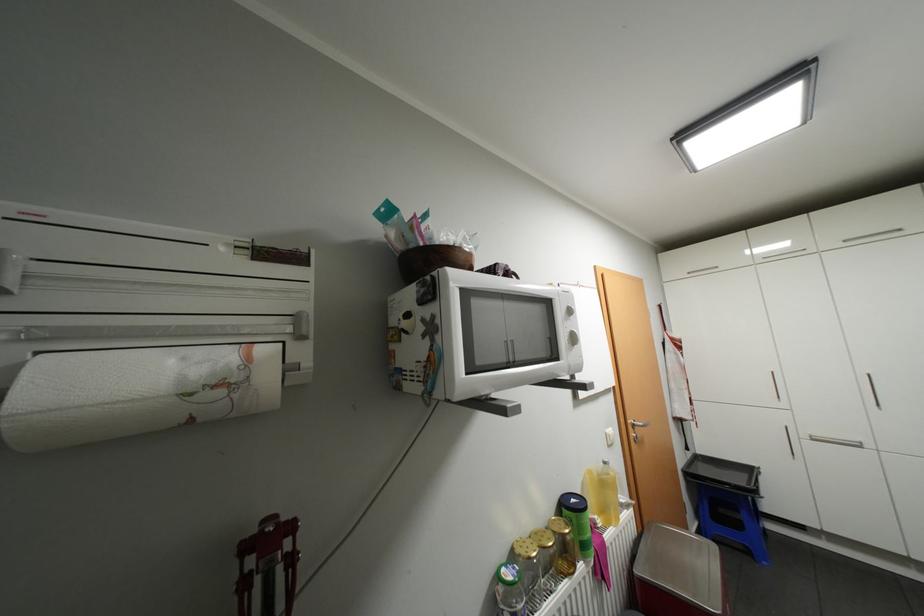
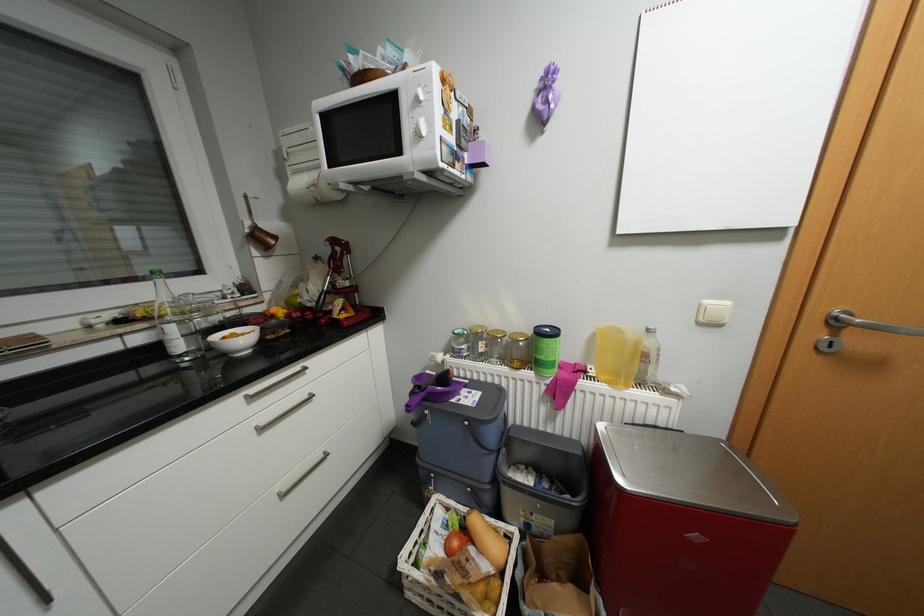
The point at (606, 521) is marked in the first image. Where is the corresponding point in the second image?

(600, 371)